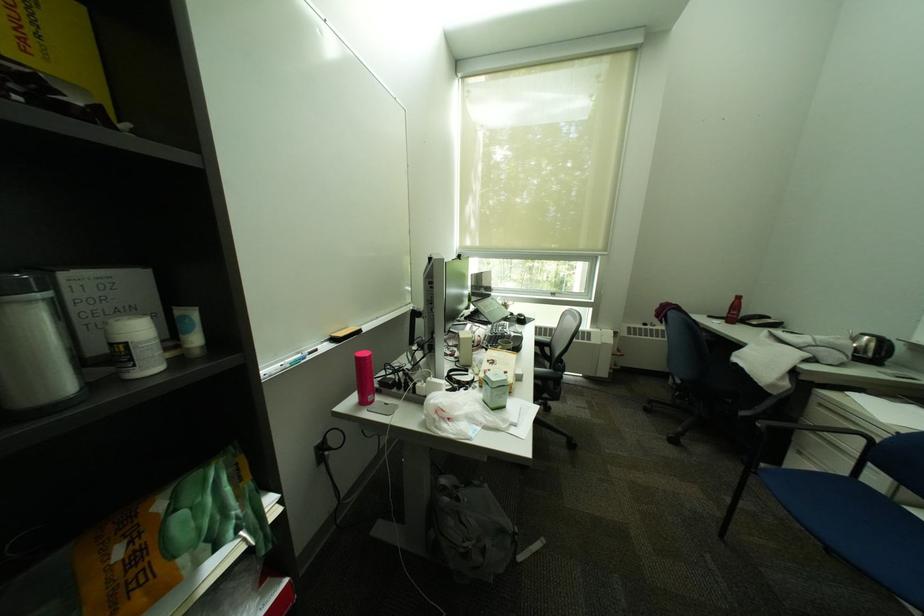
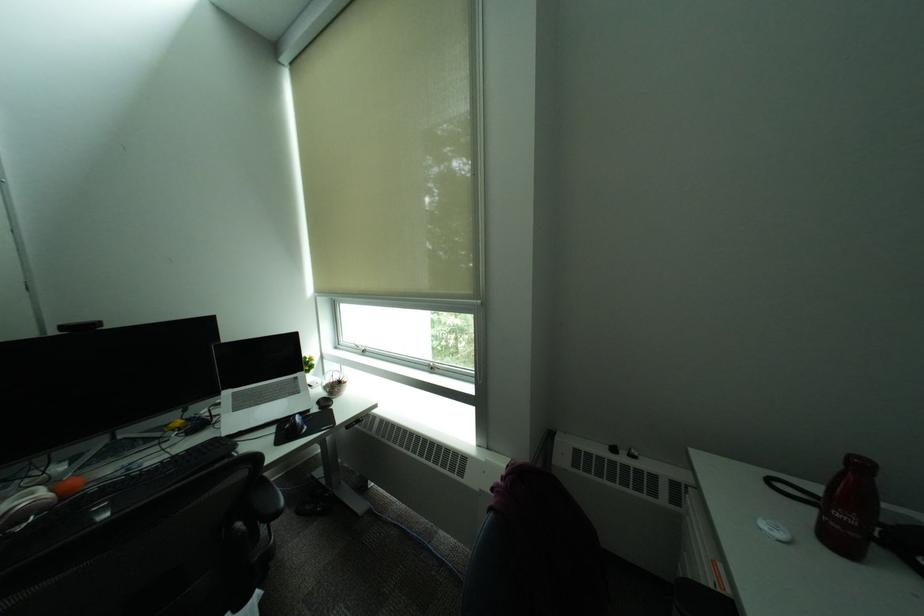
What movement of the cameraman would produce the second image?

The cameraman moved toward right, forward.